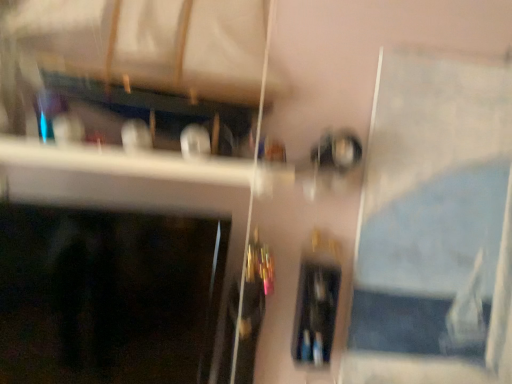
What do you see at coordinates (108, 295) in the screenshot?
I see `transparent glass screen door at lower left` at bounding box center [108, 295].

I want to click on transparent glass screen door at lower left, so click(108, 295).

Identify the location of transparent glass screen door at lower left. The width and height of the screenshot is (512, 384). pos(108,295).